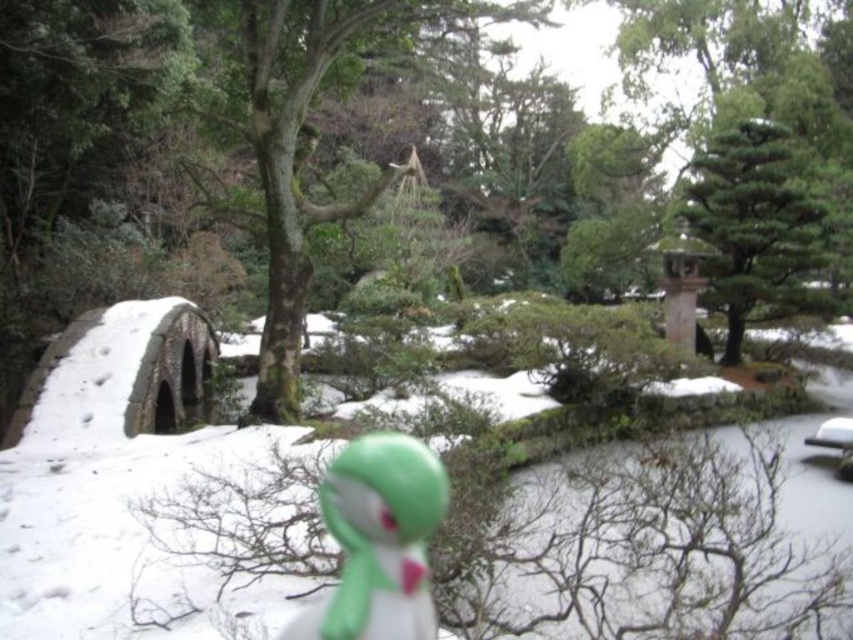
Does point (759, 172) come behind point (320, 484)?

Yes, point (759, 172) is farther from viewer.

Can you confirm if green textured tree at upper right is positioned to the right of green matte figurine at center?

Indeed, green textured tree at upper right is positioned on the right side of green matte figurine at center.

Does point (751, 160) lie in front of point (425, 460)?

No.

Identify the location of green textured tree at upper right. (756, 228).

How much distance is there between green mossy tree at center and green textured tree at upper right?

green mossy tree at center is 2.87 meters from green textured tree at upper right.

The width and height of the screenshot is (853, 640). What are the coordinates of `green mossy tree at center` in the screenshot? It's located at (305, 132).

This screenshot has width=853, height=640. What are the coordinates of `green mossy tree at center` in the screenshot? It's located at (305, 132).

Where is `green mossy tree at center`? Image resolution: width=853 pixels, height=640 pixels. green mossy tree at center is located at coordinates (305, 132).

Describe the element at coordinates (152, 508) in the screenshot. I see `white matte snow at center` at that location.

What do you see at coordinates (152, 508) in the screenshot? The image size is (853, 640). I see `white matte snow at center` at bounding box center [152, 508].

This screenshot has width=853, height=640. I want to click on white matte snow at center, so click(152, 508).